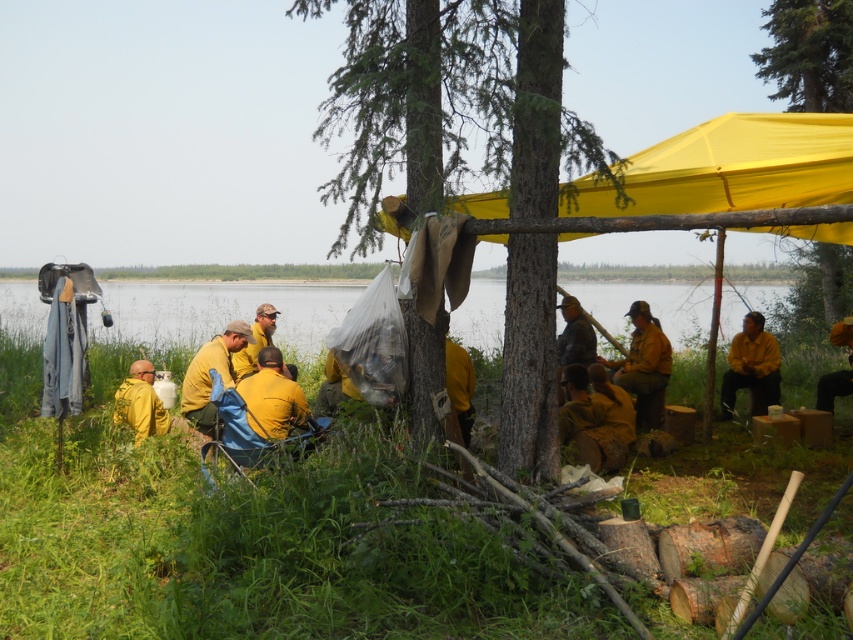
Question: Can you confirm if yellow fabric tent at center is wider than yellow matte uniform at center?

Choices:
 (A) no
 (B) yes

Answer: (B)

Question: Observing the image, what is the correct spatial positioning of smooth bark tree at center in reference to yellow fire-resistant suit at lower center?

Choices:
 (A) left
 (B) right

Answer: (A)

Question: Is yellow fabric canopy at upper center to the right of yellow matte jacket at lower right from the viewer's perspective?

Choices:
 (A) no
 (B) yes

Answer: (A)

Question: Based on their relative distances, which object is farther from the smooth bark tree at center?

Choices:
 (A) yellow fabric canopy at upper center
 (B) yellow fabric tent at center

Answer: (B)

Question: Which object is positioned farthest from the yellow matte jacket at lower right?

Choices:
 (A) yellow fire-resistant suit at center
 (B) clear water at center
 (C) matte yellow uniform at center

Answer: (A)

Question: Which of the following is the closest to the observer?

Choices:
 (A) (263, 339)
 (B) (761, 404)

Answer: (B)